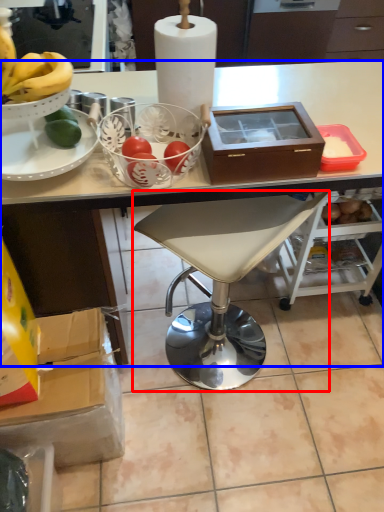
Question: Among these objects, which one is farthest to the camera, chair (highlighted by a red box) or desk (highlighted by a blue box)?

Choices:
 (A) chair
 (B) desk

Answer: (A)